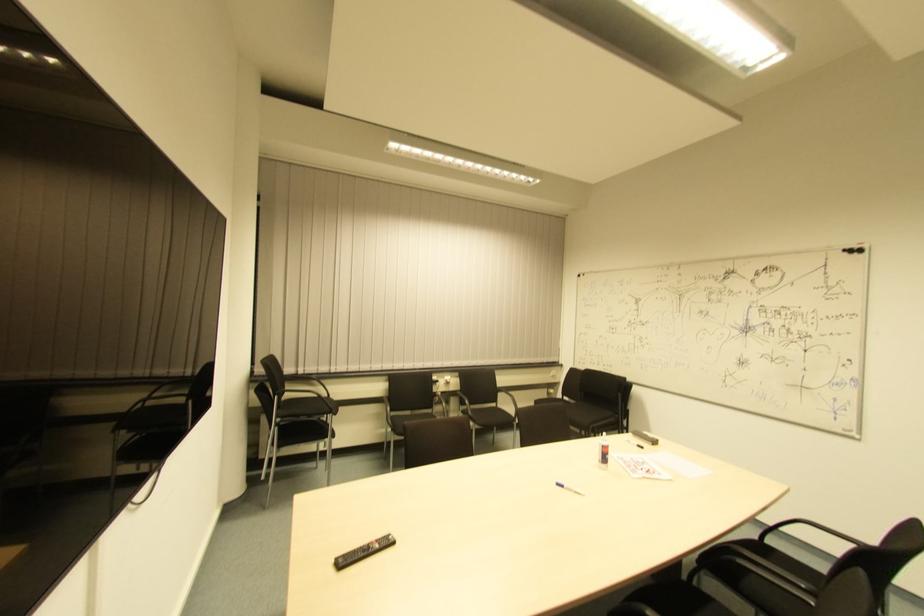
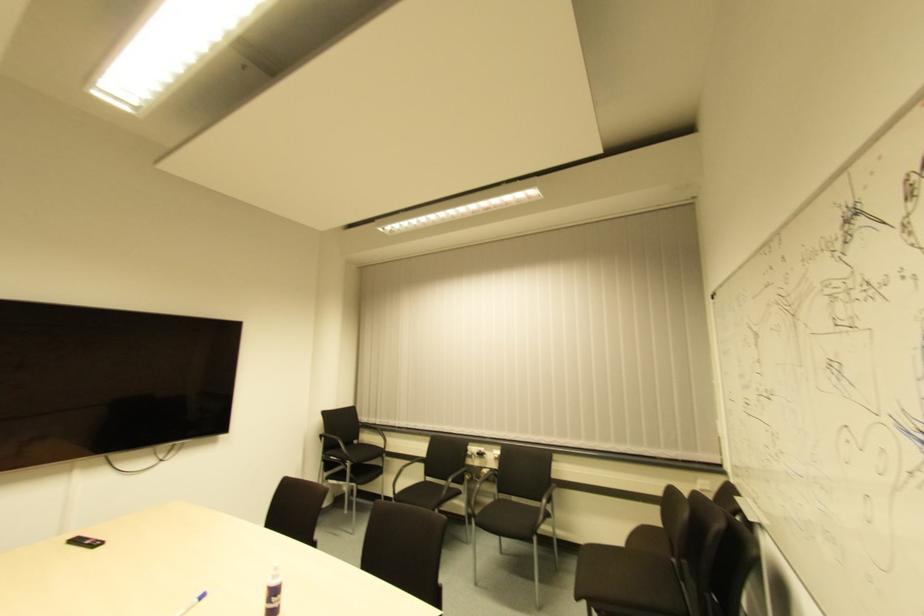
Locate, in the second image, the point that corresponds to [431,378] in the first image.

(468, 447)